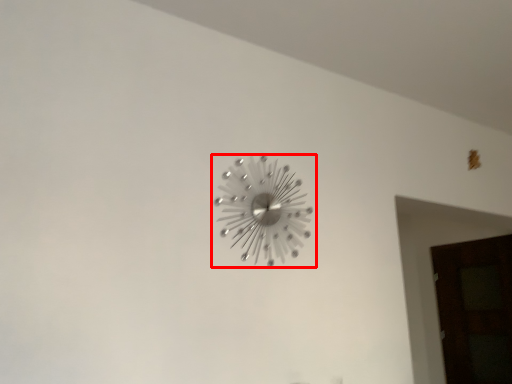
Question: Observing the image, what is the correct spatial positioning of wall clock (annotated by the red box) in reference to door?

Choices:
 (A) left
 (B) right

Answer: (A)